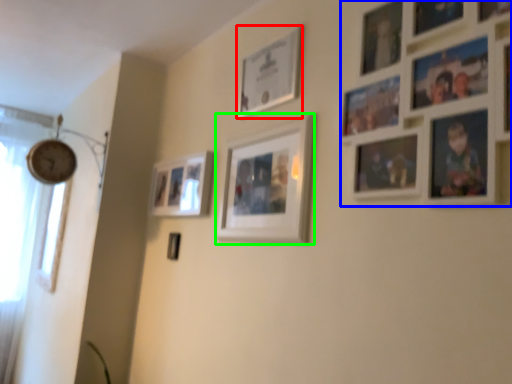
Question: Which object is the closest to the picture frame (highlighted by a red box)? Choose among these: picture frame (highlighted by a blue box) or picture frame (highlighted by a green box).

Choices:
 (A) picture frame
 (B) picture frame

Answer: (B)